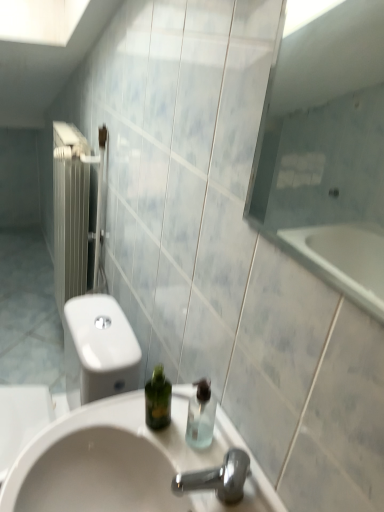
In the scene shown: Measure the distance between transparent plastic soap dispenser at center and camera.

The depth of transparent plastic soap dispenser at center is 30.04 inches.

At what (x,y) coordinates should I click in order to perform the action: click on transparent plastic soap dispenser at center. Please return your answer as a coordinate pair (x, y). Image resolution: width=384 pixels, height=512 pixels. Looking at the image, I should click on (201, 415).

Describe the element at coordinates (123, 463) in the screenshot. Image resolution: width=384 pixels, height=512 pixels. I see `white glossy sink at center` at that location.

Locate an element on the screen. transparent glass shower at right is located at coordinates (326, 150).

Does transparent glass shower at right appear on the right side of white glossy sink at center?

Correct, you'll find transparent glass shower at right to the right of white glossy sink at center.

Which of these two, transparent glass shower at right or white glossy sink at center, is smaller?

transparent glass shower at right.

Is transparent glass shower at right located outside white glossy sink at center?

Yes.

Considering their positions, is transparent glass shower at right located in front of or behind white glossy sink at center?

A: Clearly, transparent glass shower at right is in front of white glossy sink at center.

Between transparent plastic soap dispenser at center and white glossy sink at center, which one has larger size?

white glossy sink at center is bigger.

Does transparent plastic soap dispenser at center have a lesser height compared to white glossy sink at center?

Correct, transparent plastic soap dispenser at center is not as tall as white glossy sink at center.

From the image's perspective, which one is positioned higher, transparent plastic soap dispenser at center or white glossy sink at center?

transparent plastic soap dispenser at center, from the image's perspective.

Which object is positioned more to the right, white glossy sink at center or transparent glass shower at right?

transparent glass shower at right.

Considering the sizes of white glossy sink at center and transparent glass shower at right in the image, is white glossy sink at center wider or thinner than transparent glass shower at right?

white glossy sink at center is wider than transparent glass shower at right.

Is white glossy sink at center situated inside transparent glass shower at right or outside?

The correct answer is: outside.

Can you tell me how much white glossy sink at center and transparent glass shower at right differ in facing direction?

1.86 degrees separate the facing orientations of white glossy sink at center and transparent glass shower at right.

Between transparent plastic soap dispenser at center and transparent glass shower at right, which one has larger size?

transparent glass shower at right.

Are transparent plastic soap dispenser at center and transparent glass shower at right making contact?

No, transparent plastic soap dispenser at center is not beside transparent glass shower at right.

From the image's perspective, relative to transparent glass shower at right, is transparent plastic soap dispenser at center above or below?

Based on their image positions, transparent plastic soap dispenser at center is located beneath transparent glass shower at right.

Who is taller, transparent plastic soap dispenser at center or transparent glass shower at right?

With more height is transparent glass shower at right.

Is white glossy sink at center not close to transparent plastic soap dispenser at center?

No, there isn't a large distance between white glossy sink at center and transparent plastic soap dispenser at center.

Looking at their sizes, would you say white glossy sink at center is wider or thinner than transparent plastic soap dispenser at center?

Clearly, white glossy sink at center has more width compared to transparent plastic soap dispenser at center.

Where is `sink that is on the left side of transparent plastic soap dispenser at center`? Image resolution: width=384 pixels, height=512 pixels. sink that is on the left side of transparent plastic soap dispenser at center is located at coordinates (123, 463).

From the image's perspective, does white glossy sink at center appear lower than transparent plastic soap dispenser at center?

Yes, from the image's perspective, white glossy sink at center is below transparent plastic soap dispenser at center.

Does transparent glass shower at right have a lesser height compared to transparent plastic soap dispenser at center?

Incorrect, the height of transparent glass shower at right does not fall short of that of transparent plastic soap dispenser at center.

Considering the relative sizes of transparent glass shower at right and transparent plastic soap dispenser at center in the image provided, is transparent glass shower at right thinner than transparent plastic soap dispenser at center?

Yes, transparent glass shower at right is thinner than transparent plastic soap dispenser at center.

Is point (266, 197) positioned in front of point (208, 413)?

No, (266, 197) is behind (208, 413).

Considering the relative positions of transparent glass shower at right and transparent plastic soap dispenser at center in the image provided, is transparent glass shower at right to the left or to the right of transparent plastic soap dispenser at center?

Clearly, transparent glass shower at right is on the right of transparent plastic soap dispenser at center in the image.

At what (x,y) coordinates should I click in order to perform the action: click on mirror that appears on the right of white glossy sink at center. Please return your answer as a coordinate pair (x, y). This screenshot has width=384, height=512. Looking at the image, I should click on (326, 150).

Identify the location of sink that is below the transparent plastic soap dispenser at center (from the image's perspective). The height and width of the screenshot is (512, 384). (123, 463).

Based on the photo, which object lies further to the anchor point transparent glass shower at right, transparent plastic soap dispenser at center or white glossy sink at center?

Based on the image, transparent plastic soap dispenser at center appears to be further to transparent glass shower at right.

When comparing their distances from white glossy sink at center, does transparent glass shower at right or transparent plastic soap dispenser at center seem closer?

transparent plastic soap dispenser at center is positioned closer to the anchor white glossy sink at center.

Looking at the image, which one is located further to white glossy sink at center, transparent plastic soap dispenser at center or transparent glass shower at right?

Among the two, transparent glass shower at right is located further to white glossy sink at center.

From the image, which object appears to be nearer to transparent plastic soap dispenser at center, transparent glass shower at right or white glossy sink at center?

white glossy sink at center lies closer to transparent plastic soap dispenser at center than the other object.

Considering their positions, is white glossy sink at center positioned closer to transparent glass shower at right than transparent plastic soap dispenser at center?

white glossy sink at center is closer to transparent glass shower at right.

From the image, which object appears to be nearer to transparent plastic soap dispenser at center, white glossy sink at center or transparent glass shower at right?

Among the two, white glossy sink at center is located nearer to transparent plastic soap dispenser at center.

This screenshot has width=384, height=512. In order to click on soap dispenser between transparent glass shower at right and white glossy sink at center vertically in this screenshot , I will do `click(201, 415)`.